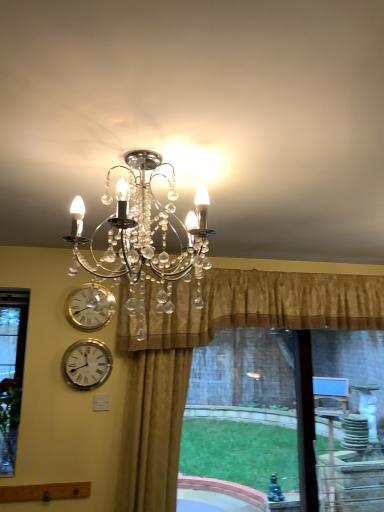
Question: Does gold textured curtain at upper center, which is the 1th curtain in right-to-left order, have a smaller size compared to gold velvet curtain at center, which appears as the 2th curtain when viewed from the right?

Choices:
 (A) yes
 (B) no

Answer: (B)

Question: Can you confirm if gold textured curtain at upper center, which is the 1th curtain in right-to-left order, is positioned to the left of gold velvet curtain at center, the 1th curtain viewed from the left?

Choices:
 (A) yes
 (B) no

Answer: (B)

Question: Considering the relative positions of gold textured curtain at upper center, marked as the 2th curtain in a left-to-right arrangement, and gold velvet curtain at center, which appears as the 2th curtain when viewed from the right, in the image provided, is gold textured curtain at upper center, marked as the 2th curtain in a left-to-right arrangement, to the right of gold velvet curtain at center, which appears as the 2th curtain when viewed from the right, from the viewer's perspective?

Choices:
 (A) no
 (B) yes

Answer: (B)

Question: Could gold velvet curtain at center, which appears as the 2th curtain when viewed from the right, be considered to be inside gold textured curtain at upper center, which is the 1th curtain in right-to-left order?

Choices:
 (A) no
 (B) yes

Answer: (B)

Question: From a real-world perspective, does gold textured curtain at upper center, marked as the 2th curtain in a left-to-right arrangement, stand above gold velvet curtain at center, the 1th curtain viewed from the left?

Choices:
 (A) yes
 (B) no

Answer: (A)

Question: Does gold textured curtain at upper center, which is the 1th curtain in right-to-left order, have a greater width compared to gold velvet curtain at center, which appears as the 2th curtain when viewed from the right?

Choices:
 (A) no
 (B) yes

Answer: (B)

Question: Would you consider silver metallic wall clock at lower left, marked as the second wall clock in a top-to-bottom arrangement, to be distant from gold textured curtain at upper center, which is the 1th curtain in right-to-left order?

Choices:
 (A) no
 (B) yes

Answer: (A)

Question: From a real-world perspective, is silver metallic wall clock at lower left, the 1th wall clock from the bottom, over gold textured curtain at upper center, marked as the 2th curtain in a left-to-right arrangement?

Choices:
 (A) no
 (B) yes

Answer: (A)

Question: Does silver metallic wall clock at lower left, marked as the second wall clock in a top-to-bottom arrangement, have a lesser height compared to gold textured curtain at upper center, which is the 1th curtain in right-to-left order?

Choices:
 (A) yes
 (B) no

Answer: (A)

Question: Can you confirm if silver metallic wall clock at lower left, the 1th wall clock from the bottom, is thinner than gold textured curtain at upper center, which is the 1th curtain in right-to-left order?

Choices:
 (A) yes
 (B) no

Answer: (A)

Question: Is silver metallic wall clock at lower left, marked as the second wall clock in a top-to-bottom arrangement, positioned behind gold textured curtain at upper center, marked as the 2th curtain in a left-to-right arrangement?

Choices:
 (A) yes
 (B) no

Answer: (A)

Question: Does silver metallic wall clock at lower left, marked as the second wall clock in a top-to-bottom arrangement, appear on the right side of gold textured curtain at upper center, marked as the 2th curtain in a left-to-right arrangement?

Choices:
 (A) no
 (B) yes

Answer: (A)

Question: Is silver metallic wall clock at lower left, the 1th wall clock from the bottom, touching gold velvet curtain at center, which appears as the 2th curtain when viewed from the right?

Choices:
 (A) no
 (B) yes

Answer: (A)